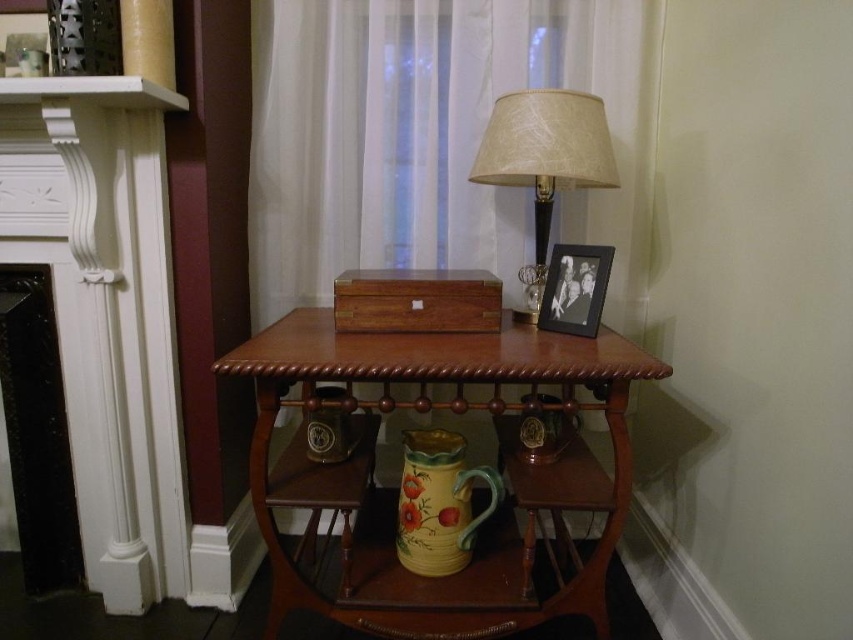
Question: Does beige fabric lampshade at upper right have a greater width compared to white painted wood mantle at upper left?

Choices:
 (A) yes
 (B) no

Answer: (B)

Question: Which of the following is the closest to the observer?

Choices:
 (A) (114, 321)
 (B) (300, 314)
 (C) (4, 84)

Answer: (C)

Question: Which point is closer to the camera?

Choices:
 (A) (564, 99)
 (B) (160, 438)

Answer: (A)

Question: Among these objects, which one is farthest from the camera?

Choices:
 (A) beige fabric lampshade at upper right
 (B) matte ceramic vase at center
 (C) mahogany wood table at center
 (D) sheer white curtain at upper center

Answer: (D)

Question: Can you confirm if white painted wood fireplace at left is bigger than mahogany wood table at center?

Choices:
 (A) no
 (B) yes

Answer: (A)

Question: Does mahogany wood table at center appear under beige fabric lampshade at upper right?

Choices:
 (A) no
 (B) yes

Answer: (B)